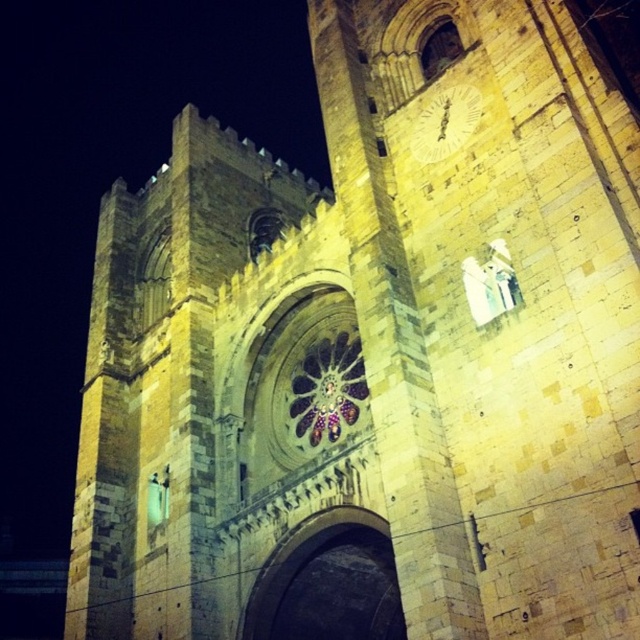
You are standing in front of the cathedral and want to take a photo of the dark stone archway at center. If your camera has a maximum focus range of 50 meters, will it be able to capture the archway clearly?

The dark stone archway at center is 46.52 meters away from the viewer. Since the camera can focus up to 50 meters, it is within range, so yes, the camera can capture the archway clearly.

You are standing in front of the cathedral and notice the dark stone archway at center and the white glossy clock at upper center. Which object is located to the left of the other?

The dark stone archway at center is positioned on the left side of white glossy clock at upper center.

You are standing outside the cathedral and notice the dark stone archway at center and the white glossy clock at upper center. Which object is closer to you?

The dark stone archway at center is closer to you because it is in front of the white glossy clock at upper center.